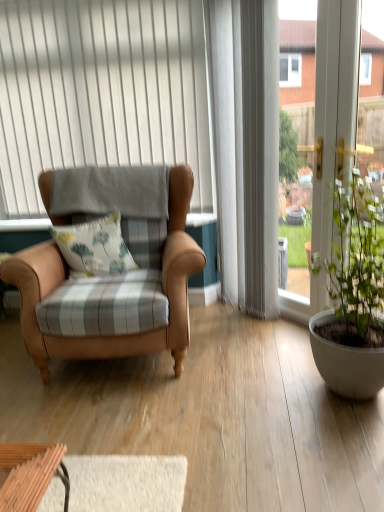
Locate an element on the screen. The width and height of the screenshot is (384, 512). unoccupied region to the right of leather armchair at left is located at coordinates (268, 358).